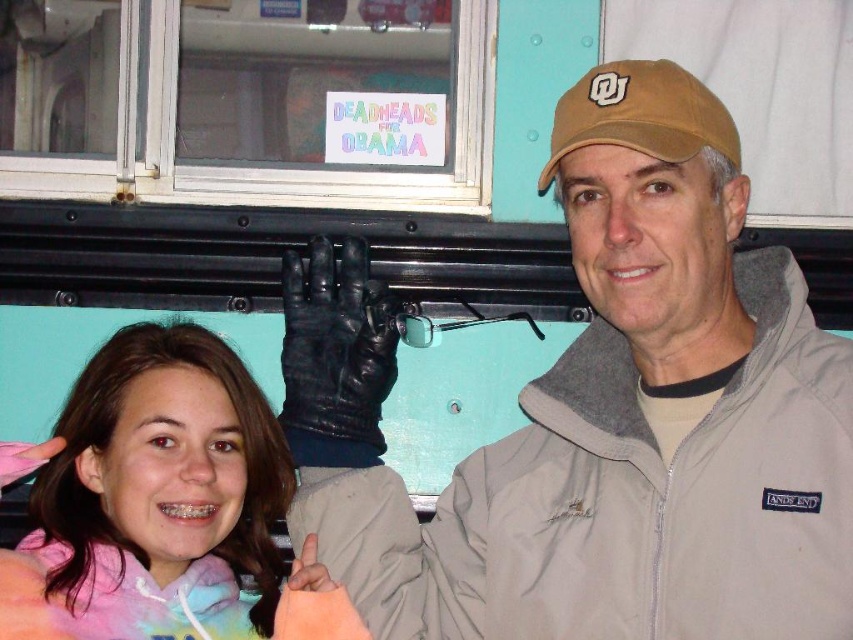
Question: Does tie-dye hoodie at lower left appear on the right side of brown fabric baseball cap at upper right?

Choices:
 (A) no
 (B) yes

Answer: (A)

Question: Which object is closer to the camera taking this photo?

Choices:
 (A) brown fabric baseball cap at upper right
 (B) tie-dye hoodie at lower left

Answer: (B)

Question: Which of these objects is positioned farthest from the tie-dye hoodie at lower left?

Choices:
 (A) tan fabric cap at upper center
 (B) brown fabric baseball cap at upper right

Answer: (B)

Question: Observing the image, what is the correct spatial positioning of tan fabric cap at upper center in reference to brown fabric baseball cap at upper right?

Choices:
 (A) right
 (B) left

Answer: (B)

Question: Which point is farther to the camera?

Choices:
 (A) (616, 92)
 (B) (68, 404)

Answer: (B)

Question: Can you confirm if tan fabric cap at upper center is positioned above brown fabric baseball cap at upper right?

Choices:
 (A) yes
 (B) no

Answer: (B)